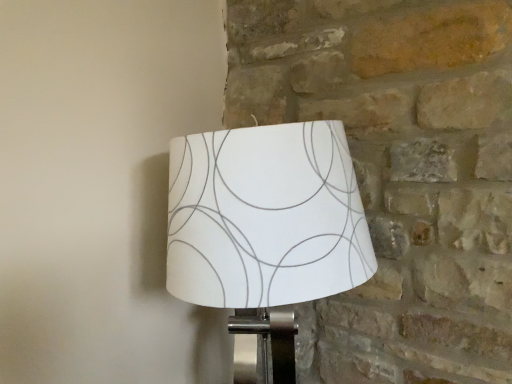
What do you see at coordinates (265, 232) in the screenshot? I see `white paper lampshade at center` at bounding box center [265, 232].

Identify the location of white paper lampshade at center. This screenshot has height=384, width=512. (265, 232).

This screenshot has height=384, width=512. What are the coordinates of `white paper lampshade at center` in the screenshot? It's located at (265, 232).